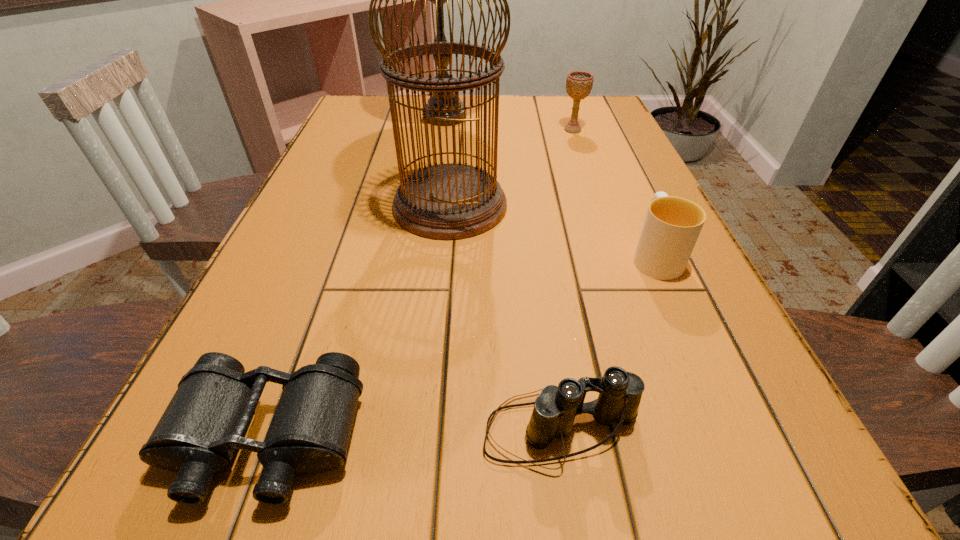
Locate an element on the screen. The image size is (960, 540). vacant area that satisfies the following two spatial constraints: 1. on the front-facing side of the birdcage; 2. on the right side of the fifth tallest object is located at coordinates (430, 430).

Where is `vacant region that satisfies the following two spatial constraints: 1. on the front-facing side of the birdcage; 2. on the back side of the right binoculars`? The image size is (960, 540). vacant region that satisfies the following two spatial constraints: 1. on the front-facing side of the birdcage; 2. on the back side of the right binoculars is located at coordinates (430, 430).